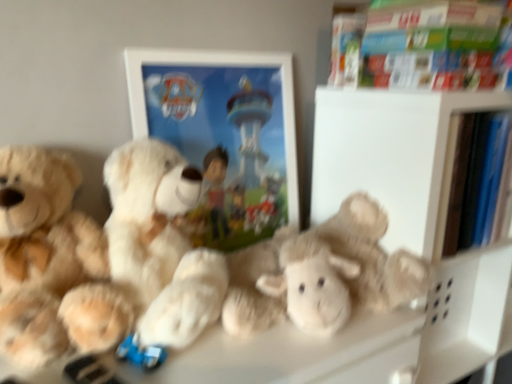
Question: Considering the relative positions of fluffy white teddy bear at center, positioned as the third teddy bear in left-to-right order, and soft plush teddy bear at left, which ranks as the 3th teddy bear in right-to-left order, in the image provided, is fluffy white teddy bear at center, positioned as the third teddy bear in left-to-right order, to the left or to the right of soft plush teddy bear at left, which ranks as the 3th teddy bear in right-to-left order,?

Choices:
 (A) right
 (B) left

Answer: (A)

Question: From the image's perspective, is fluffy white teddy bear at center, which is the 1th teddy bear from right to left, positioned above or below soft plush teddy bear at left, which ranks as the 3th teddy bear in right-to-left order?

Choices:
 (A) above
 (B) below

Answer: (B)

Question: Based on their relative distances, which object is nearer to the soft plush teddy bear at left, which ranks as the 3th teddy bear in right-to-left order?

Choices:
 (A) hardcover book at upper right
 (B) fluffy white teddy bear at center, which is the 1th teddy bear from right to left
 (C) white matte picture frame at center
 (D) fluffy white teddy bear at center, the second teddy bear from the right

Answer: (D)

Question: Which object is positioned farthest from the fluffy white teddy bear at center, which is the 1th teddy bear from right to left?

Choices:
 (A) fluffy white teddy bear at center, which is counted as the second teddy bear, starting from the left
 (B) soft plush teddy bear at left, which ranks as the first teddy bear in left-to-right order
 (C) white matte picture frame at center
 (D) hardcover book at upper right

Answer: (D)